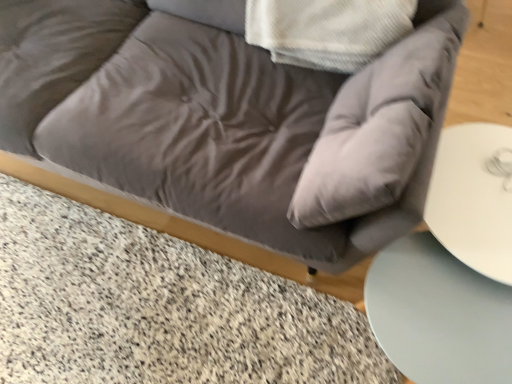
Consider the image. Measure the distance between point (62, 53) and camera.

Point (62, 53) is 4.54 feet from camera.

Locate an element on the screen. smooth white table at lower right is located at coordinates (439, 314).

Based on their positions, is smooth white table at lower right located to the left or right of granite textured marble at lower left?

Based on their positions, smooth white table at lower right is located to the right of granite textured marble at lower left.

Is granite textured marble at lower left a part of smooth white table at lower right?

Answer: No, granite textured marble at lower left is not surrounded by smooth white table at lower right.

Looking at this image, is the position of smooth white table at lower right less distant than that of granite textured marble at lower left?

Yes, smooth white table at lower right is in front of granite textured marble at lower left.

Considering the relative sizes of smooth white table at lower right and granite textured marble at lower left in the image provided, is smooth white table at lower right smaller than granite textured marble at lower left?

Actually, smooth white table at lower right might be larger than granite textured marble at lower left.

How much distance is there between satin gray couch at center and granite textured marble at lower left?

The distance of satin gray couch at center from granite textured marble at lower left is 18.38 inches.

From a real-world perspective, is satin gray couch at center below granite textured marble at lower left?

No, from a real-world perspective, satin gray couch at center is not under granite textured marble at lower left.

Consider the image. Would you say satin gray couch at center is inside or outside granite textured marble at lower left?

satin gray couch at center is spatially situated outside granite textured marble at lower left.

Are satin gray couch at center and granite textured marble at lower left located far from each other?

That's not correct — satin gray couch at center is a little close to granite textured marble at lower left.

Is smooth white table at lower right shorter than satin gray couch at center?

Yes.

Does smooth white table at lower right contain satin gray couch at center?

No, satin gray couch at center is not a part of smooth white table at lower right.

Considering the positions of objects smooth white table at lower right and satin gray couch at center in the image provided, who is in front, smooth white table at lower right or satin gray couch at center?

satin gray couch at center.

Could you tell me if smooth white table at lower right is turned towards satin gray couch at center?

No.

Does satin gray couch at center come in front of smooth white table at lower right?

Yes.

Are satin gray couch at center and smooth white table at lower right far apart?

No, satin gray couch at center is not far away from smooth white table at lower right.

Between satin gray couch at center and smooth white table at lower right, which one has less height?

→ Standing shorter between the two is smooth white table at lower right.

Which of these two, granite textured marble at lower left or smooth white table at lower right, is bigger?

With larger size is smooth white table at lower right.

Is point (215, 299) positioned behind point (476, 326)?

Yes, point (215, 299) is behind point (476, 326).

Between granite textured marble at lower left and smooth white table at lower right, which one has less height?

With less height is granite textured marble at lower left.

From a real-world perspective, which is physically above, granite textured marble at lower left or smooth white table at lower right?

From a 3D spatial view, smooth white table at lower right is above.

Is granite textured marble at lower left not close to satin gray couch at center?

They are positioned close to each other.

Looking at this image, choose the correct answer: Is granite textured marble at lower left inside satin gray couch at center or outside it?

granite textured marble at lower left cannot be found inside satin gray couch at center.

Which is more to the left, granite textured marble at lower left or satin gray couch at center?

Positioned to the left is satin gray couch at center.

This screenshot has width=512, height=384. In order to click on table below the granite textured marble at lower left (from the image's perspective) in this screenshot , I will do [x=439, y=314].

I want to click on studio couch that is on the left side of granite textured marble at lower left, so click(x=229, y=122).

Based on their spatial positions, is satin gray couch at center or smooth white table at lower right closer to granite textured marble at lower left?

The object closer to granite textured marble at lower left is satin gray couch at center.

Which object lies nearer to the anchor point satin gray couch at center, smooth white table at lower right or granite textured marble at lower left?

Among the two, smooth white table at lower right is located nearer to satin gray couch at center.

Looking at the image, which one is located further to smooth white table at lower right, satin gray couch at center or granite textured marble at lower left?

The object further to smooth white table at lower right is granite textured marble at lower left.

From the picture: Considering their positions, is granite textured marble at lower left positioned closer to satin gray couch at center than smooth white table at lower right?

smooth white table at lower right is positioned closer to the anchor satin gray couch at center.

Estimate the real-world distances between objects in this image. Which object is further from granite textured marble at lower left, smooth white table at lower right or satin gray couch at center?

smooth white table at lower right is positioned further to the anchor granite textured marble at lower left.

Looking at this image, estimate the real-world distances between objects in this image. Which object is further from smooth white table at lower right, granite textured marble at lower left or satin gray couch at center?

granite textured marble at lower left is further to smooth white table at lower right.

This screenshot has width=512, height=384. Find the location of `marble between satin gray couch at center and smooth white table at lower right in the up-down direction`. marble between satin gray couch at center and smooth white table at lower right in the up-down direction is located at coordinates (158, 308).